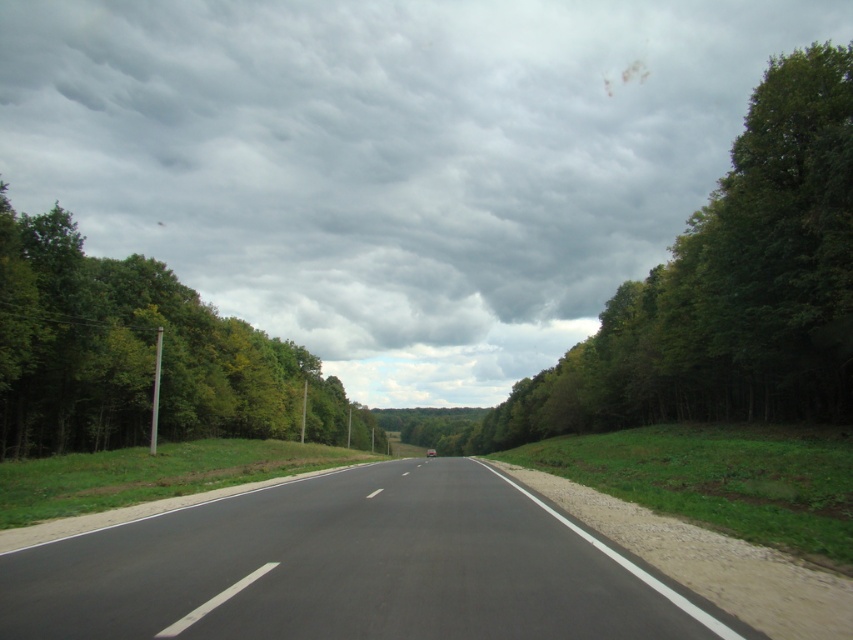
Between cloudy sky at upper center and green leafy tree at left, which one has more height?

cloudy sky at upper center

This screenshot has width=853, height=640. What are the coordinates of `cloudy sky at upper center` in the screenshot? It's located at (389, 156).

You are a GUI agent. You are given a task and a screenshot of the screen. Output one action in this format:
    pyautogui.click(x=<x>, y=<y>)
    Task: Click on the cloudy sky at upper center
    
    Given the screenshot: What is the action you would take?
    pyautogui.click(x=389, y=156)

Which is above, green leafy tree at right or green leafy tree at left?

green leafy tree at right

Is green leafy tree at right thinner than green leafy tree at left?

In fact, green leafy tree at right might be wider than green leafy tree at left.

Where is `green leafy tree at right`? The width and height of the screenshot is (853, 640). green leafy tree at right is located at coordinates (721, 291).

Which is more to the left, cloudy sky at upper center or black asphalt highway at center?

cloudy sky at upper center is more to the left.

Does cloudy sky at upper center appear over black asphalt highway at center?

Indeed, cloudy sky at upper center is positioned over black asphalt highway at center.

What do you see at coordinates (389, 156) in the screenshot?
I see `cloudy sky at upper center` at bounding box center [389, 156].

What are the coordinates of `cloudy sky at upper center` in the screenshot? It's located at (389, 156).